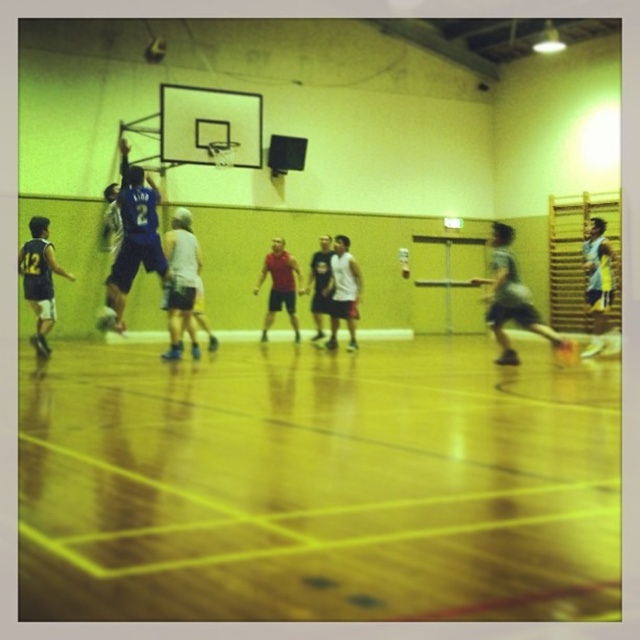
In the scene shown: You are a spectator at the basketball game. You notice the yellow jersey at right and the white matte basketball player at center. Which player appears shorter in the image?

The yellow jersey at right appears shorter than the white matte basketball player at center.

You are a spectator sitting at the back of the gymnasium watching the basketball game. You notice two points marked in the scene. Which point is closer to you, point (609, 296) or point (346, 236)?

Point (609, 296) is closer to you than point (346, 236).

You are a photographer positioned at the gymnasium entrance. You need to capture a photo of both the dark blue jersey at left and the white matte basketball player at center. Which subject should you focus on first to ensure both fit in the frame?

The dark blue jersey at left is wider than the white matte basketball player at center, so you should focus on the dark blue jersey at left first to ensure both fit in the frame.